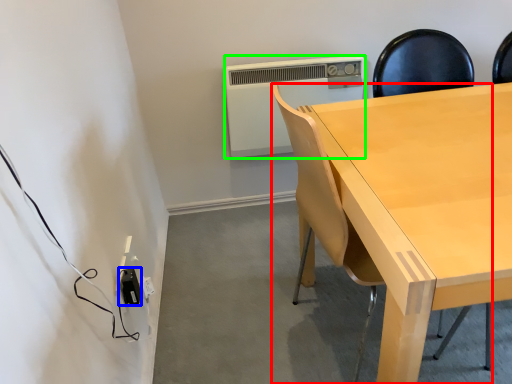
Question: Which object is positioned closest to chair (highlighted by a red box)? Select from electric outlet (highlighted by a blue box) and air conditioning (highlighted by a green box).

Choices:
 (A) electric outlet
 (B) air conditioning

Answer: (A)